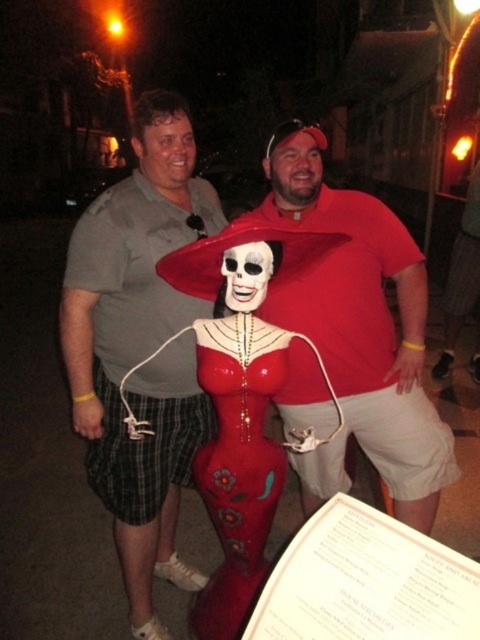
Question: Can you confirm if matte plastic statue at center is wider than glossy plastic statue at center?

Choices:
 (A) yes
 (B) no

Answer: (A)

Question: Does gray cotton shirt at center appear on the right side of matte red shirt at center?

Choices:
 (A) no
 (B) yes

Answer: (A)

Question: Which of the following is the closest to the observer?

Choices:
 (A) gray cotton shirt at center
 (B) matte red shirt at center
 (C) glossy plastic statue at center
 (D) matte red dress at center

Answer: (C)

Question: Which point is farther from the camera taking this photo?

Choices:
 (A) (259, 566)
 (B) (305, 218)

Answer: (B)

Question: Which point is farther to the camera?

Choices:
 (A) (332, 237)
 (B) (94, 337)
 (C) (291, 220)

Answer: (C)

Question: Is gray cotton shirt at center bigger than glossy plastic statue at center?

Choices:
 (A) yes
 (B) no

Answer: (A)